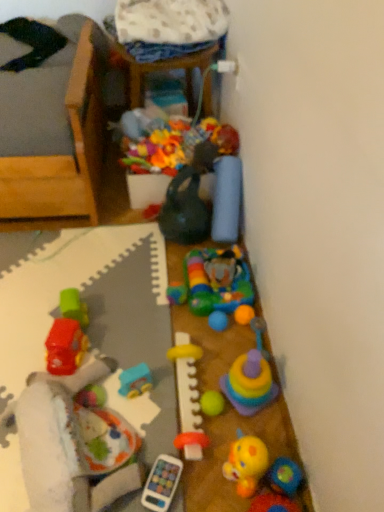
You are a GUI agent. You are given a task and a screenshot of the screen. Output one action in this format:
    pyautogui.click(x=<x>, y=<y>)
    Task: Click on the free spot to the right of green rubber ball at center, which appears as the 5th toy when viewed from the left
    Image resolution: width=384 pixels, height=512 pixels.
    Given the screenshot: What is the action you would take?
    pyautogui.click(x=263, y=423)